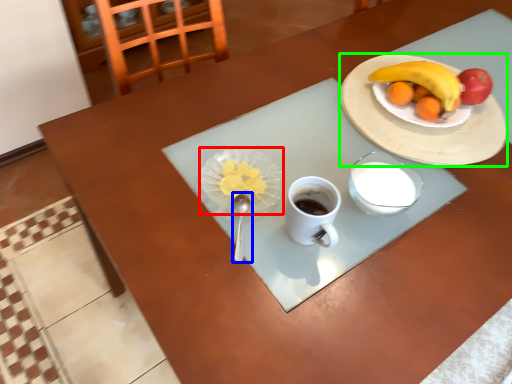
Question: Based on their relative distances, which object is farther from tableware (highlighted by a red box)? Choose from utensil (highlighted by a blue box) and plate (highlighted by a green box).

Choices:
 (A) utensil
 (B) plate

Answer: (B)